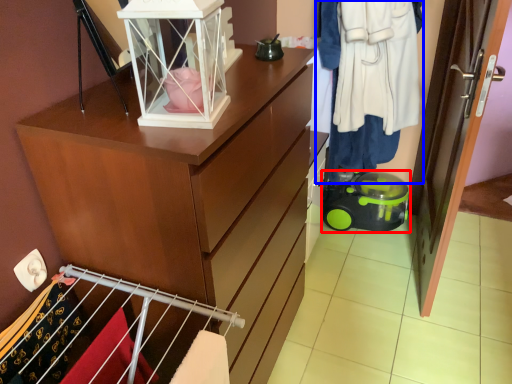
Question: Which object is closer to the camera taking this photo, toy (highlighted by a red box) or clothing (highlighted by a blue box)?

Choices:
 (A) toy
 (B) clothing

Answer: (B)